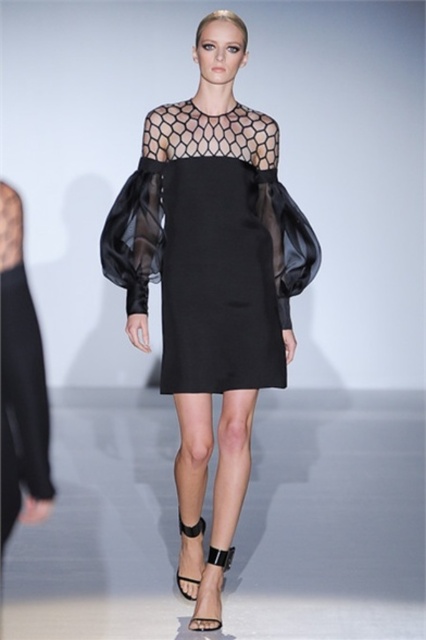
Measure the distance between black sheer dress at center and camera.

A distance of 8.04 feet exists between black sheer dress at center and camera.

Does black sheer dress at center have a smaller size compared to black leather sandal at center?

Answer: Incorrect, black sheer dress at center is not smaller in size than black leather sandal at center.

Is point (244, 272) closer to viewer compared to point (181, 589)?

Yes, it is in front of point (181, 589).

The height and width of the screenshot is (640, 426). In order to click on black sheer dress at center in this screenshot , I will do `click(212, 266)`.

Between point (210, 545) and point (203, 529), which one is positioned in front?

Point (210, 545)

Who is positioned more to the right, black leather sandal at lower center or black leather sandal at center?

black leather sandal at lower center is more to the right.

Which is behind, point (201, 627) or point (189, 532)?

The point (189, 532) is behind.

Locate an element on the screen. The image size is (426, 640). black leather sandal at lower center is located at coordinates (213, 592).

Is black sheer dress at center bigger than black leather sandal at lower center?

Correct, black sheer dress at center is larger in size than black leather sandal at lower center.

Looking at this image, does black sheer dress at center lie in front of black leather sandal at lower center?

Yes, it is in front of black leather sandal at lower center.

Which is behind, point (137, 204) or point (215, 586)?

Positioned behind is point (137, 204).

Locate an element on the screen. The image size is (426, 640). black sheer dress at center is located at coordinates (212, 266).